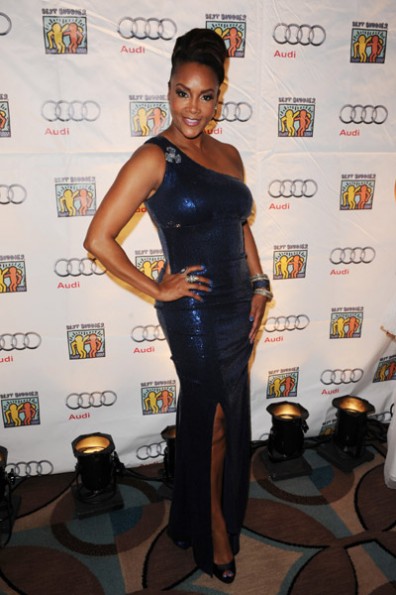
Locate an element on the screen. backdrop is located at coordinates 293,233.